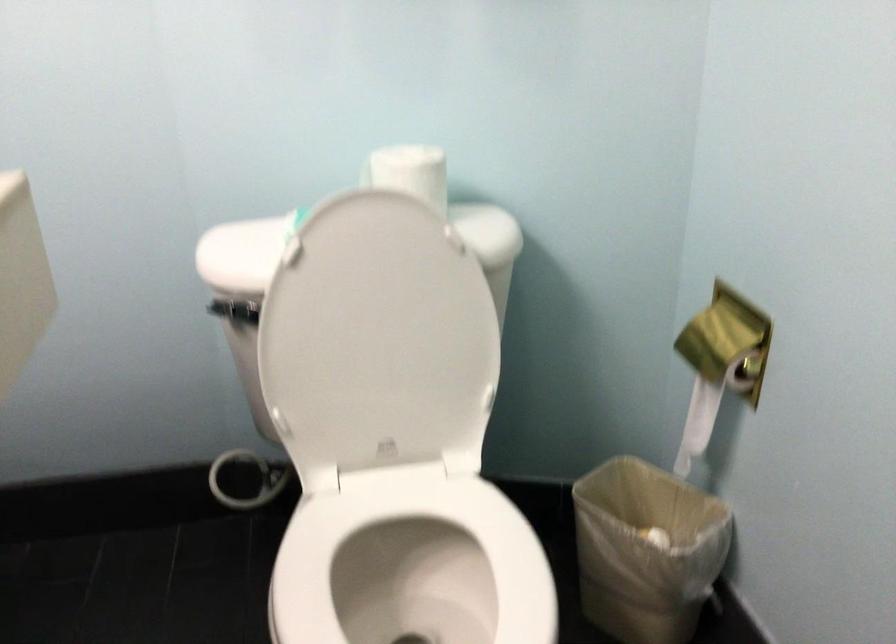
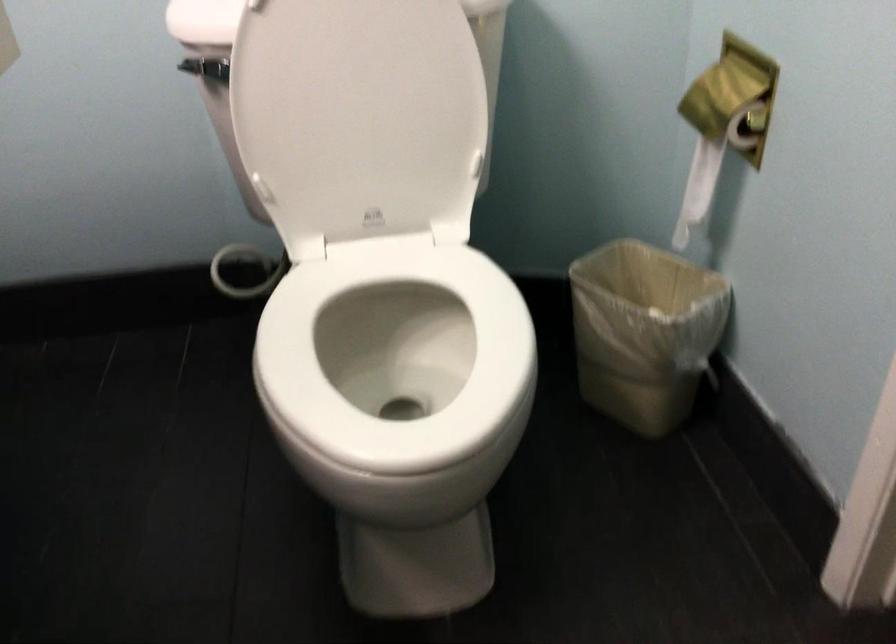
In the second image, find the point that corresponds to the point at 378,357 in the first image.

(359, 114)